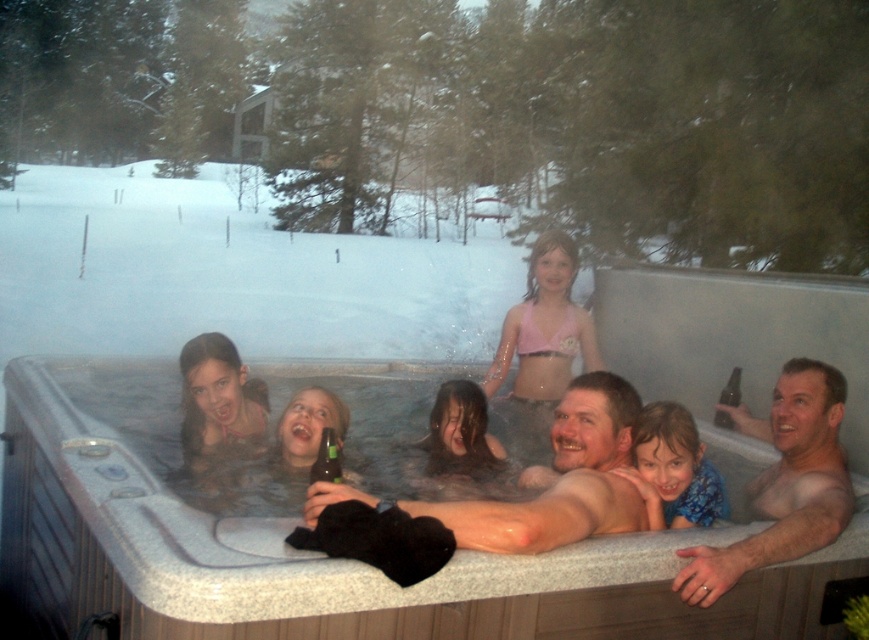
Can you confirm if smooth skin adult at center is shorter than bare skin man at center?

Yes.

Locate an element on the screen. The height and width of the screenshot is (640, 869). smooth skin adult at center is located at coordinates (561, 480).

Is point (580, 474) positioned behind point (788, 472)?

That is False.

You are a GUI agent. You are given a task and a screenshot of the screen. Output one action in this format:
    pyautogui.click(x=<x>, y=<y>)
    Task: Click on the smooth skin adult at center
    The image size is (869, 640).
    Given the screenshot: What is the action you would take?
    pyautogui.click(x=561, y=480)

Does smooth gray hot tub at center have a greater width compared to blue fabric at center?

Correct, the width of smooth gray hot tub at center exceeds that of blue fabric at center.

Is smooth gray hot tub at center smaller than blue fabric at center?

Incorrect, smooth gray hot tub at center is not smaller in size than blue fabric at center.

Who is more distant from viewer, (450, 600) or (713, 484)?

Positioned behind is point (713, 484).

Identify the location of smooth gray hot tub at center. This screenshot has height=640, width=869. (316, 557).

Who is positioned more to the left, smooth gray hot tub at center or smooth skin adult at center?

smooth gray hot tub at center is more to the left.

Based on the photo, who is taller, smooth gray hot tub at center or smooth skin adult at center?

With more height is smooth gray hot tub at center.

Is point (819, 580) positioned before point (587, 484)?

That is False.

At what (x,y) coordinates should I click in order to perform the action: click on smooth gray hot tub at center. Please return your answer as a coordinate pair (x, y). The image size is (869, 640). Looking at the image, I should click on (316, 557).